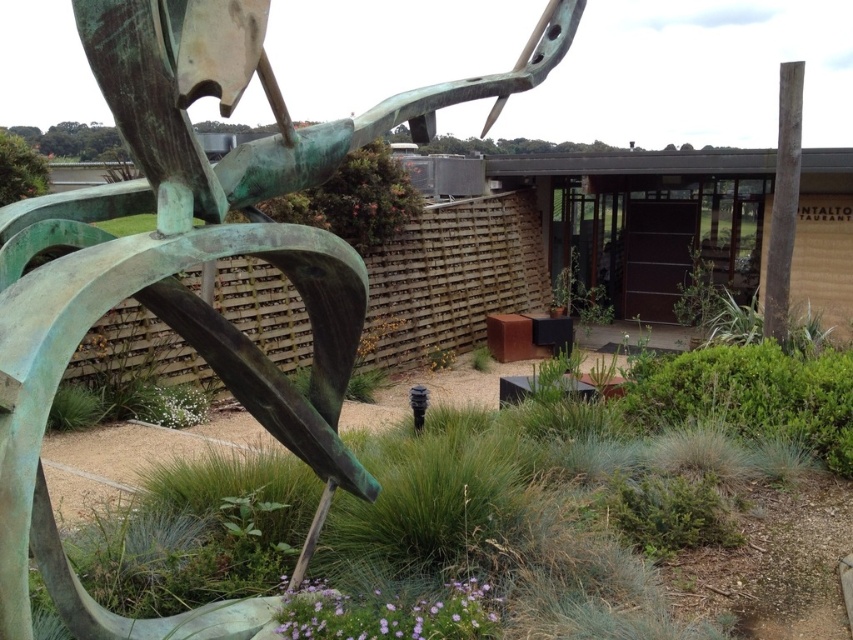
Question: Which of the following is the closest to the observer?

Choices:
 (A) (39, 380)
 (B) (373, 442)

Answer: (A)

Question: Is green patina metal sculpture at left to the left of green patina sculpture at center-left from the viewer's perspective?

Choices:
 (A) no
 (B) yes

Answer: (B)

Question: Which of the following is the closest to the observer?

Choices:
 (A) green patina metal sculpture at left
 (B) green patina sculpture at center-left

Answer: (A)

Question: Observing the image, what is the correct spatial positioning of green patina metal sculpture at left in reference to green patina sculpture at center-left?

Choices:
 (A) right
 (B) left

Answer: (B)

Question: Observing the image, what is the correct spatial positioning of green patina metal sculpture at left in reference to green patina sculpture at center-left?

Choices:
 (A) above
 (B) below

Answer: (A)